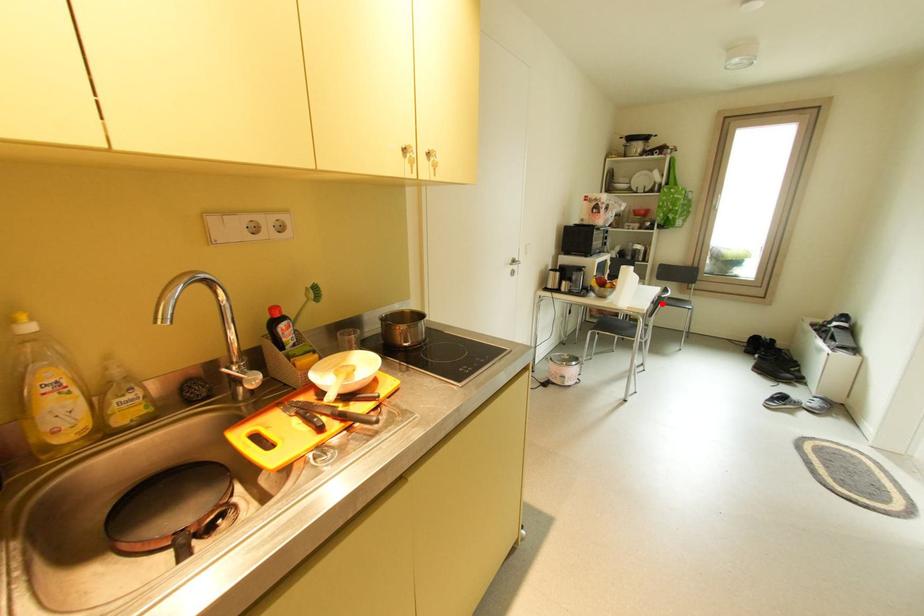
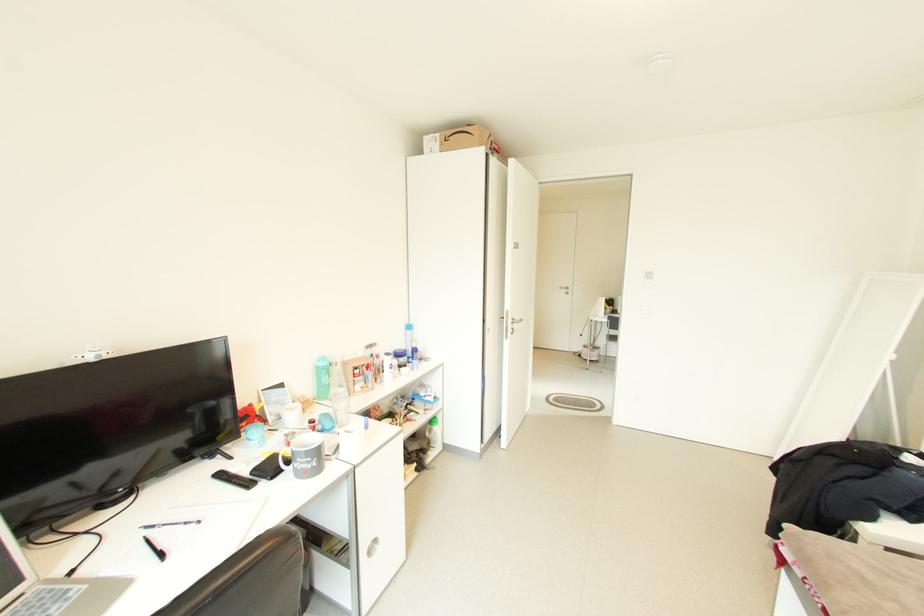
Question: I am providing you with two images of the same scene from different viewpoints. A red point is marked on the first image. At the location where the point appears in image 1, is it still visible in image 2?

Choices:
 (A) Yes
 (B) No

Answer: (B)